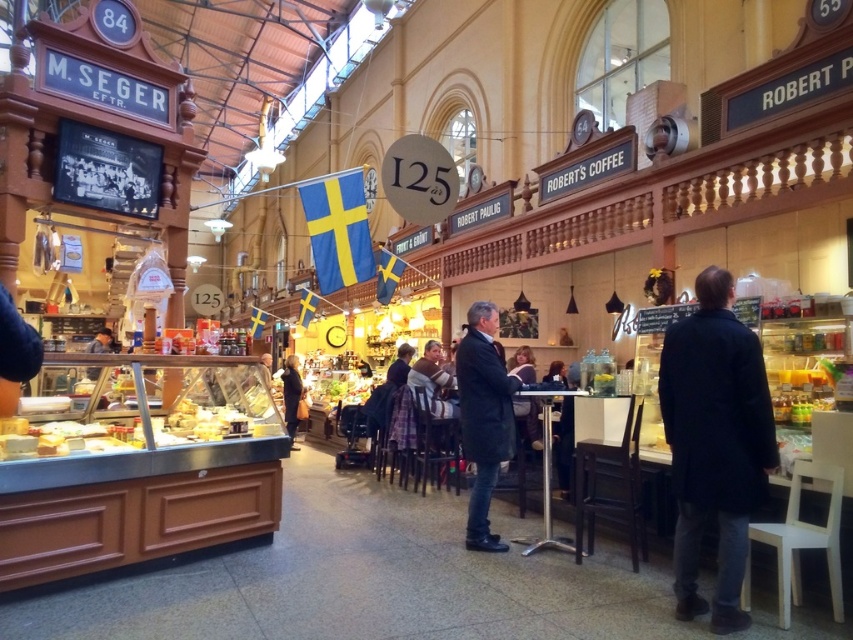
You are a customer at the market and want to try on both the dark blue coat at center and the dark gray coat at center. Which coat should you pick up first based on their positions?

The dark blue coat at center is located above the dark gray coat at center, so you should pick up the dark gray coat at center first since it is lower and more accessible.

You are shopping at a market in Sweden and see two coats hanging on a rack at the center of the store. The coats are labeled as dark blue coat at center and dark gray coat at center. According to their positions, which coat is located to the right when facing the rack?

The dark blue coat at center is to the right of the dark gray coat at center, so the dark blue coat at center is located to the right when facing the rack.